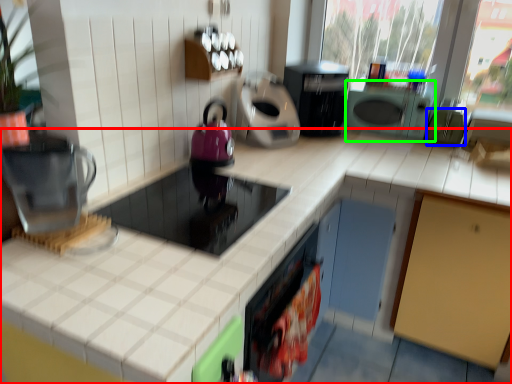
Question: Which is farther away from countertop (highlighted by a red box)? appliance (highlighted by a blue box) or appliance (highlighted by a green box)?

Choices:
 (A) appliance
 (B) appliance

Answer: (A)